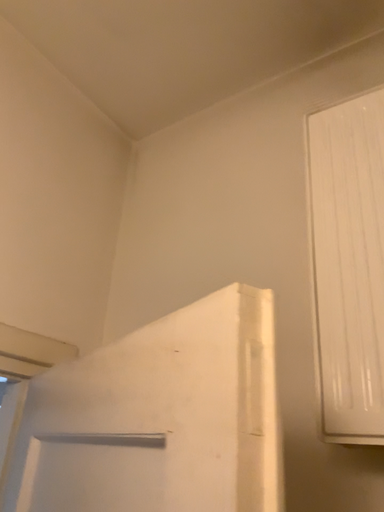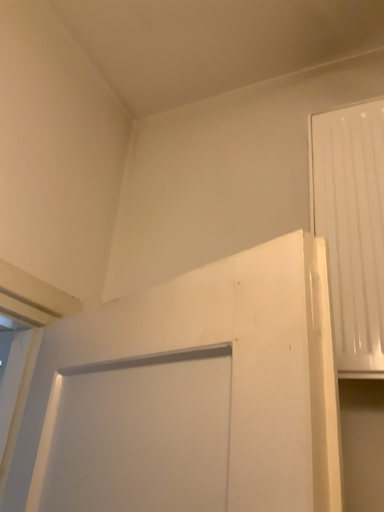
Question: How did the camera likely rotate when shooting the video?

Choices:
 (A) rotated right
 (B) rotated left

Answer: (A)